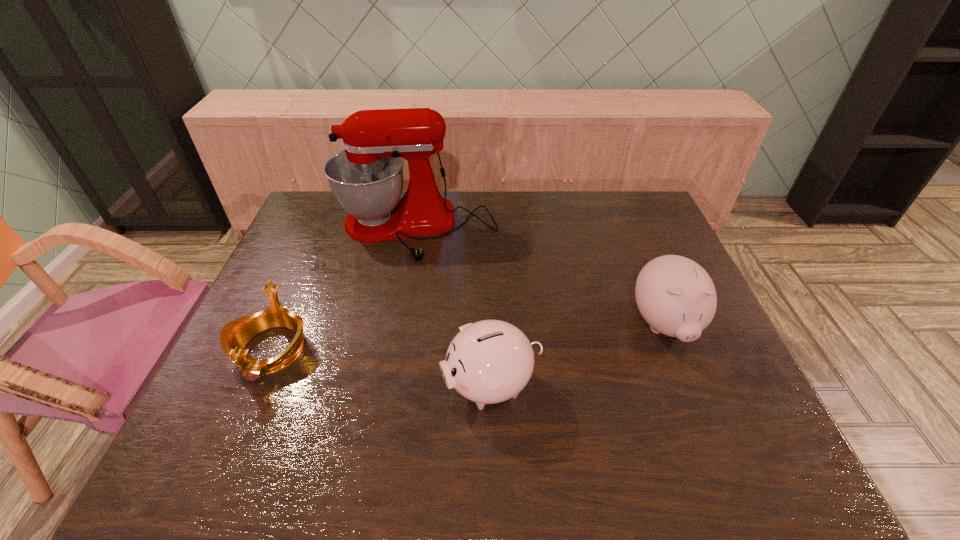
This screenshot has height=540, width=960. Find the location of `mixer that is positioned at the left edge`. mixer that is positioned at the left edge is located at coordinates (366, 178).

This screenshot has height=540, width=960. Identify the location of tiara that is at the left edge. (234, 336).

You are a GUI agent. You are given a task and a screenshot of the screen. Output one action in this format:
    pyautogui.click(x=<x>, y=<y>)
    Task: Click on the object at the right edge
    This screenshot has width=960, height=540.
    Given the screenshot: What is the action you would take?
    pyautogui.click(x=676, y=296)

The height and width of the screenshot is (540, 960). I want to click on object that is at the far left corner, so click(x=366, y=178).

At what (x,y) coordinates should I click in order to perform the action: click on vacant region at the far edge of the desktop. Please return your answer as a coordinate pair (x, y). Looking at the image, I should click on (483, 192).

In the image, there is a desktop. Identify the location of vacant space at the near edge. (402, 460).

In the image, there is a desktop. Where is `vacant region at the left edge`? The image size is (960, 540). vacant region at the left edge is located at coordinates pos(284,271).

Locate an element on the screen. This screenshot has height=540, width=960. vacant space at the right edge is located at coordinates (676, 362).

You are a GUI agent. You are given a task and a screenshot of the screen. Output one action in this format:
    pyautogui.click(x=<x>, y=<y>)
    Task: Click on the vacant space that's between the right piggy bank and the mixer
    The width and height of the screenshot is (960, 540).
    Given the screenshot: What is the action you would take?
    pyautogui.click(x=540, y=278)

Locate an element on the screen. free point between the right piggy bank and the left piggy bank is located at coordinates (578, 355).